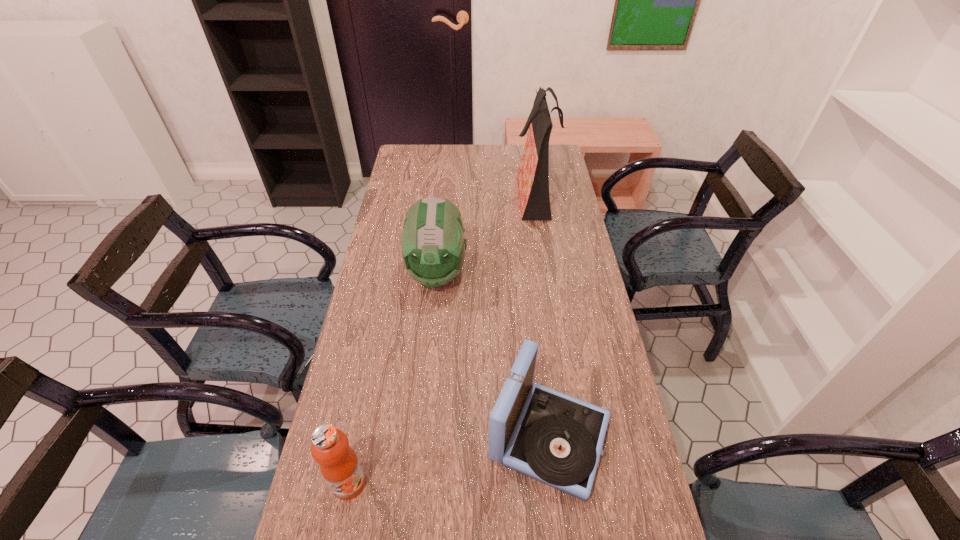
Image resolution: width=960 pixels, height=540 pixels. Identify the location of vacant space situated on the front label of the leftmost object. (339, 535).

You are a GUI agent. You are given a task and a screenshot of the screen. Output one action in this format:
    pyautogui.click(x=<x>, y=<y>)
    Task: Click on the free space located 0.090m on the back of the phonograph record
    
    Given the screenshot: What is the action you would take?
    pyautogui.click(x=540, y=358)

What are the coordinates of `object present at the far edge` in the screenshot? It's located at (533, 175).

Locate an element on the screen. football helmet situated at the left edge is located at coordinates (433, 246).

Find the location of `fruit juice located at the left edge`. fruit juice located at the left edge is located at coordinates (339, 465).

Identify the location of shopping bag that is at the right edge. This screenshot has width=960, height=540. (533, 175).

This screenshot has width=960, height=540. In order to click on phonograph record present at the right edge in this screenshot , I will do click(x=556, y=439).

Identify the location of object that is at the far right corner. This screenshot has width=960, height=540. [533, 175].

What are the coordinates of `vacant space at the far edge` in the screenshot? It's located at (502, 145).

In the image, there is a desktop. Where is `blank space at the left edge`? The image size is (960, 540). blank space at the left edge is located at coordinates 377,269.